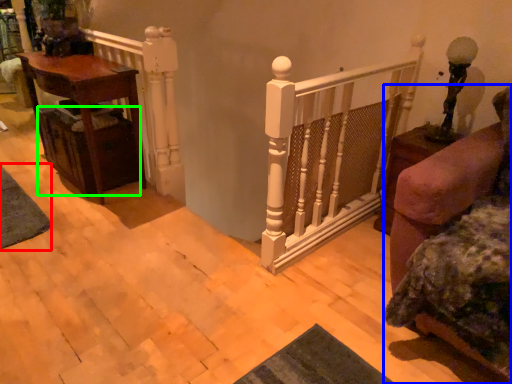
Question: Which object is positioned closest to mat (highlighted by a red box)? Select from furniture (highlighted by a blue box) and drawer (highlighted by a green box).

Choices:
 (A) furniture
 (B) drawer

Answer: (B)